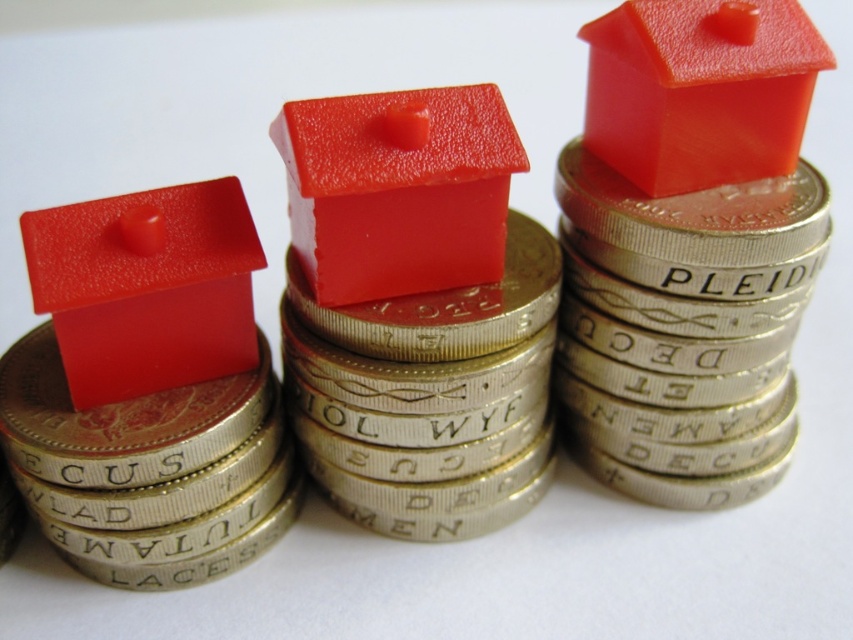
Question: Observing the image, what is the correct spatial positioning of matte plastic house at center in reference to matte gold coin at left?

Choices:
 (A) left
 (B) right

Answer: (B)

Question: Is the position of matte plastic house at center less distant than that of transparent red house at upper right?

Choices:
 (A) yes
 (B) no

Answer: (A)

Question: Based on their relative distances, which object is nearer to the matte gold coin at left?

Choices:
 (A) glossy plastic house at center
 (B) matte plastic house at center
 (C) matte red house at left
 (D) transparent red house at upper right

Answer: (C)

Question: Which object is closer to the camera taking this photo?

Choices:
 (A) matte gold coin at left
 (B) glossy plastic house at center

Answer: (A)

Question: Does transparent red house at upper right appear over matte gold coin at left?

Choices:
 (A) yes
 (B) no

Answer: (A)

Question: Which of the following is the farthest from the observer?

Choices:
 (A) (183, 202)
 (B) (526, 321)

Answer: (B)